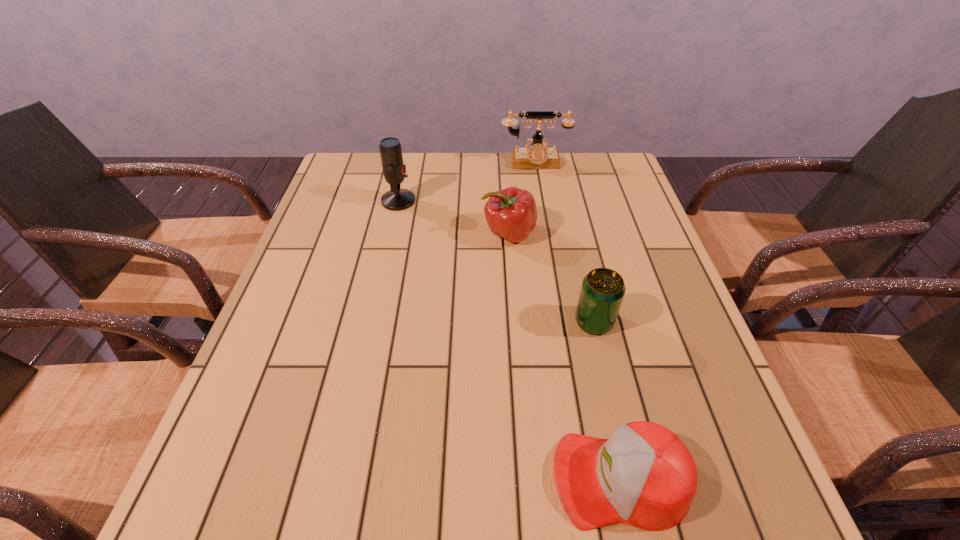
This screenshot has width=960, height=540. In order to click on vacant space at the near edge in this screenshot , I will do `click(451, 483)`.

In the image, there is a desktop. What are the coordinates of `vacant space at the left edge` in the screenshot? It's located at (329, 320).

In order to click on vacant area at the right edge in this screenshot , I will do `click(630, 243)`.

You are a GUI agent. You are given a task and a screenshot of the screen. Output one action in this format:
    pyautogui.click(x=<x>, y=<y>)
    Task: Click on the vacant space at the far right corner
    
    Given the screenshot: What is the action you would take?
    pyautogui.click(x=579, y=179)

Locate an element on the screen. The width and height of the screenshot is (960, 540). empty location between the leftmost object and the shortest object is located at coordinates (509, 340).

Identify the location of free point between the fourth farthest object and the telephone. This screenshot has width=960, height=540. (564, 242).

Locate an element on the screen. This screenshot has height=540, width=960. vacant area between the shortest object and the fourth farthest object is located at coordinates (607, 400).

Where is `vacant area that lies between the telephone and the microphone`? The height and width of the screenshot is (540, 960). vacant area that lies between the telephone and the microphone is located at coordinates (467, 183).

What are the coordinates of `free space between the beer can and the farthest object` in the screenshot? It's located at (564, 242).

Identify the location of free space between the fourth nearest object and the farthest object. This screenshot has height=540, width=960. (467, 183).